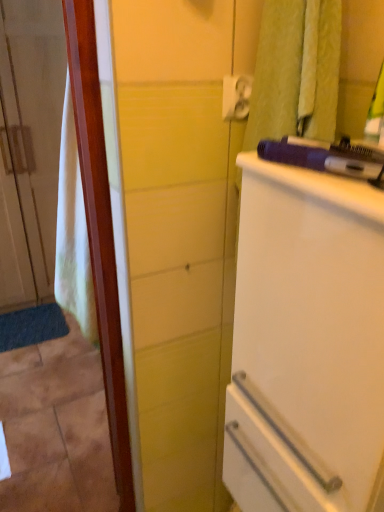
Question: Could white plastic towel bar at upper right be considered to be inside white glossy refrigerator at right?

Choices:
 (A) yes
 (B) no

Answer: (B)

Question: From a real-world perspective, is white glossy refrigerator at right under white plastic towel bar at upper right?

Choices:
 (A) yes
 (B) no

Answer: (A)

Question: Can you confirm if white glossy refrigerator at right is positioned to the left of white plastic towel bar at upper right?

Choices:
 (A) no
 (B) yes

Answer: (A)

Question: Is white glossy refrigerator at right aimed at white plastic towel bar at upper right?

Choices:
 (A) no
 (B) yes

Answer: (A)

Question: Is white glossy refrigerator at right located outside white plastic towel bar at upper right?

Choices:
 (A) yes
 (B) no

Answer: (A)

Question: From their relative heights in the image, would you say white fabric door at left is taller or shorter than white glossy refrigerator at right?

Choices:
 (A) tall
 (B) short

Answer: (A)

Question: Based on their positions, is white fabric door at left located to the left or right of white glossy refrigerator at right?

Choices:
 (A) left
 (B) right

Answer: (A)

Question: Considering their positions, is white fabric door at left located in front of or behind white glossy refrigerator at right?

Choices:
 (A) behind
 (B) front

Answer: (A)

Question: From a real-world perspective, is white fabric door at left above or below white glossy refrigerator at right?

Choices:
 (A) below
 (B) above

Answer: (B)

Question: Looking at the image, does purple plastic hairdryer at upper right seem bigger or smaller compared to white fabric door at left?

Choices:
 (A) small
 (B) big

Answer: (A)

Question: Is purple plastic hairdryer at upper right wider or thinner than white fabric door at left?

Choices:
 (A) wide
 (B) thin

Answer: (B)

Question: From their relative heights in the image, would you say purple plastic hairdryer at upper right is taller or shorter than white fabric door at left?

Choices:
 (A) tall
 (B) short

Answer: (B)

Question: Is purple plastic hairdryer at upper right to the left or to the right of white fabric door at left in the image?

Choices:
 (A) right
 (B) left

Answer: (A)

Question: From their relative heights in the image, would you say white plastic towel bar at upper right is taller or shorter than purple plastic hairdryer at upper right?

Choices:
 (A) short
 (B) tall

Answer: (B)

Question: Relative to purple plastic hairdryer at upper right, is white plastic towel bar at upper right in front or behind?

Choices:
 (A) behind
 (B) front

Answer: (A)